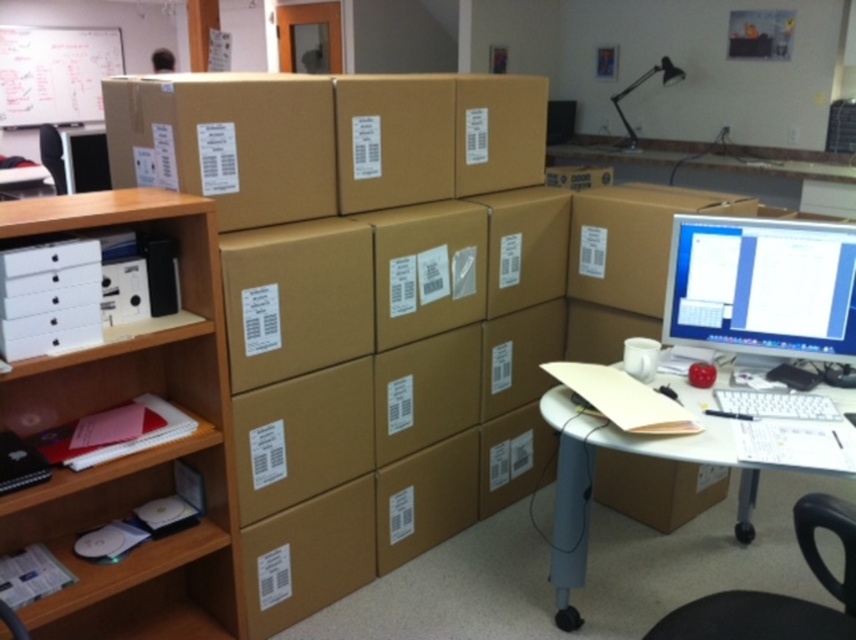
Which of these two, matte black monitor at right or black plastic swivel chair at lower right, stands taller?

matte black monitor at right is taller.

Does matte black monitor at right have a smaller size compared to black plastic swivel chair at lower right?

No, matte black monitor at right is not smaller than black plastic swivel chair at lower right.

What are the coordinates of `matte black monitor at right` in the screenshot? It's located at (762, 288).

At what (x,y) coordinates should I click in order to perform the action: click on matte black monitor at right. Please return your answer as a coordinate pair (x, y). Looking at the image, I should click on (762, 288).

Is point (45, 512) positioned behind point (586, 458)?

No, (45, 512) is closer to viewer.

In the scene shown: Which is below, white cardboard bookshelf at left or matte brown desk at lower right?

matte brown desk at lower right is below.

Image resolution: width=856 pixels, height=640 pixels. I want to click on white cardboard bookshelf at left, so click(134, 452).

Locate an element on the screen. This screenshot has height=640, width=856. white cardboard bookshelf at left is located at coordinates (134, 452).

Is white cardboard bookshelf at left bigger than matte black monitor at right?

Yes.

Does white cardboard bookshelf at left appear on the left side of matte black monitor at right?

Correct, you'll find white cardboard bookshelf at left to the left of matte black monitor at right.

Between point (43, 490) and point (774, 248), which one is positioned behind?

The point (774, 248) is more distant.

Find the location of `white cardboard bookshelf at left`. white cardboard bookshelf at left is located at coordinates (134, 452).